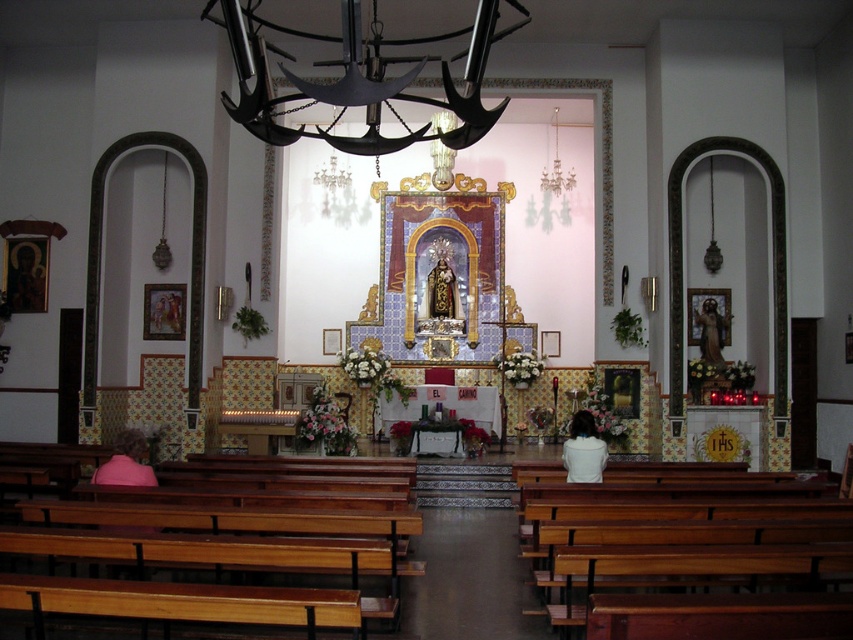
You are standing in the church and looking at the two points marked in the image. Which point, point (131, 435) or point (699, 337), is closer to you?

Point (131, 435) is closer to you than point (699, 337).

You are standing in the church and want to place a small bouquet of flowers between the pink fabric at lower left and the wooden statue at right. Based on their positions, where should you place the bouquet?

The pink fabric at lower left is positioned on the left side of wooden statue at right, so you should place the bouquet between them, ensuring it is centered between the pink fabric at lower left and the wooden statue at right.

You are standing in the church and want to place a small candle on the white fabric at center. Is there enough space for it?

The white fabric at center is located at point (583, 449), so there is enough space to place a small candle on it.